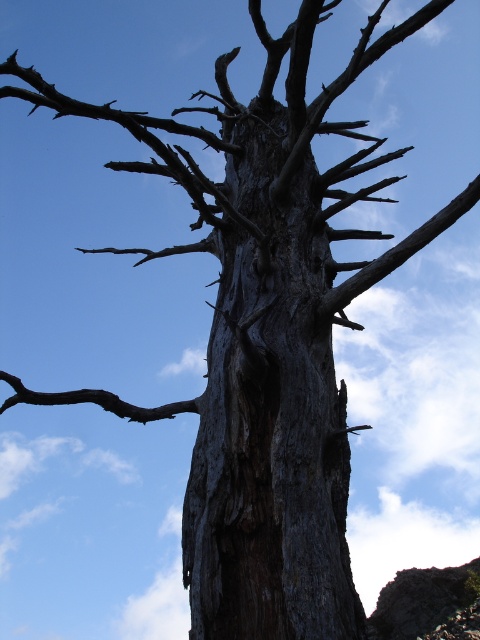
You are a bird looking for a nesting spot. You see the dark gray bark tree trunk at center and the brown rough branch at lower left. Which one is taller?

The dark gray bark tree trunk at center is taller than the brown rough branch at lower left.

You are standing in front of a tall, weathered tree trunk against a clear blue sky. You notice a specific point marked at coordinates [269,408]. What does this point indicate?

The point at [269,408] marks the location of the dark gray bark tree trunk at the center of the image.